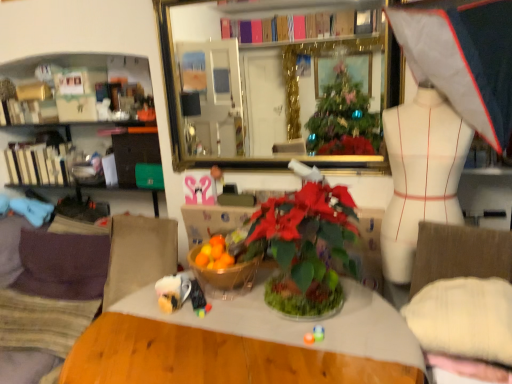
Question: Does suede-like beige couch at lower left touch translucent glass bowl at center?

Choices:
 (A) yes
 (B) no

Answer: (B)

Question: Is suede-like beige couch at lower left shorter than translucent glass bowl at center?

Choices:
 (A) yes
 (B) no

Answer: (B)

Question: Can we say suede-like beige couch at lower left lies outside translucent glass bowl at center?

Choices:
 (A) no
 (B) yes

Answer: (B)

Question: Is suede-like beige couch at lower left oriented towards translucent glass bowl at center?

Choices:
 (A) no
 (B) yes

Answer: (B)

Question: Considering the relative sizes of suede-like beige couch at lower left and translucent glass bowl at center in the image provided, is suede-like beige couch at lower left thinner than translucent glass bowl at center?

Choices:
 (A) no
 (B) yes

Answer: (A)

Question: From a real-world perspective, is translucent glass bowl at center physically located above or below suede-like beige couch at lower left?

Choices:
 (A) above
 (B) below

Answer: (A)

Question: Does point (242, 281) appear closer or farther from the camera than point (42, 248)?

Choices:
 (A) farther
 (B) closer

Answer: (B)

Question: Is translucent glass bowl at center in front of or behind suede-like beige couch at lower left in the image?

Choices:
 (A) behind
 (B) front

Answer: (B)

Question: Is translucent glass bowl at center inside or outside of suede-like beige couch at lower left?

Choices:
 (A) inside
 (B) outside

Answer: (B)

Question: From the image's perspective, is gold-framed mirror at upper center above or below white matte mannequin at right?

Choices:
 (A) below
 (B) above

Answer: (B)

Question: Is gold-framed mirror at upper center taller or shorter than white matte mannequin at right?

Choices:
 (A) tall
 (B) short

Answer: (B)

Question: Considering the positions of point (195, 117) and point (412, 231), is point (195, 117) closer or farther from the camera than point (412, 231)?

Choices:
 (A) farther
 (B) closer

Answer: (A)

Question: From a real-world perspective, is gold-framed mirror at upper center positioned above or below white matte mannequin at right?

Choices:
 (A) below
 (B) above

Answer: (B)

Question: Looking at the image, does gold-framed mirror at upper center seem bigger or smaller compared to white fabric umbrella at upper right?

Choices:
 (A) big
 (B) small

Answer: (B)

Question: Considering the relative positions of gold-framed mirror at upper center and white fabric umbrella at upper right in the image provided, is gold-framed mirror at upper center to the left or to the right of white fabric umbrella at upper right?

Choices:
 (A) right
 (B) left

Answer: (B)